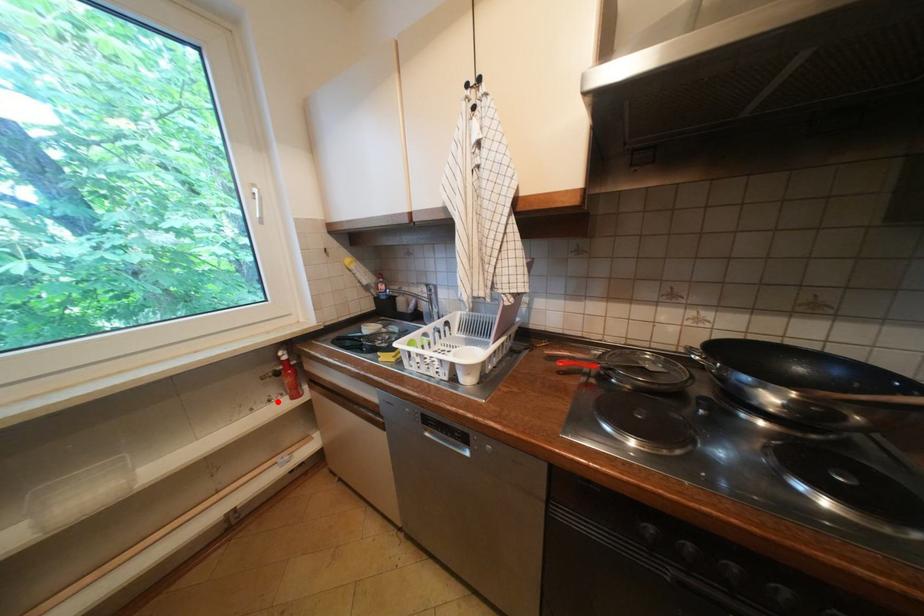
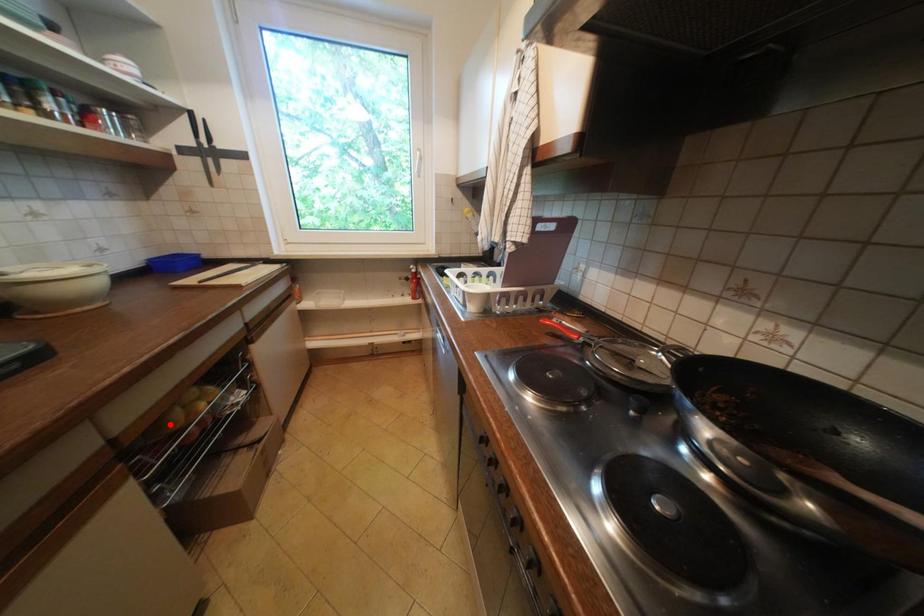
I am providing you with two images of the same scene from different viewpoints. A red point is marked on the first image and another point is marked on the second image. Is the marked point in image1 the same physical position as the marked point in image2?

No